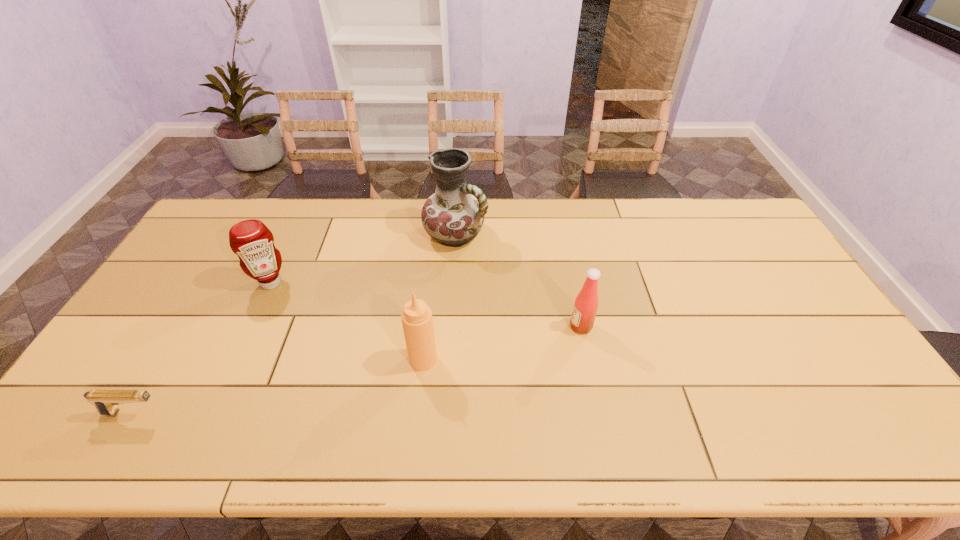
This screenshot has height=540, width=960. I want to click on vacant space that is in between the leftmost condiment and the nearest condiment, so click(348, 321).

Find the location of `vacant space that's between the fourth farthest object and the leftmost condiment`. vacant space that's between the fourth farthest object and the leftmost condiment is located at coordinates (348, 321).

Image resolution: width=960 pixels, height=540 pixels. Find the location of `empty location between the shortest object and the nearest condiment`. empty location between the shortest object and the nearest condiment is located at coordinates (278, 386).

Where is `free spot between the second farthest condiment and the fourth farthest object`? The image size is (960, 540). free spot between the second farthest condiment and the fourth farthest object is located at coordinates (502, 343).

Where is `the closest object relative to the second nearest object`? the closest object relative to the second nearest object is located at coordinates (585, 306).

This screenshot has height=540, width=960. What are the coordinates of `object that is the closest to the leftmost object` in the screenshot? It's located at (251, 240).

Choose which condiment is the nearest neighbor to the farthest condiment. Please provide its 2D coordinates. Your answer should be formatted as a tuple, i.e. [(x, y)], where the tuple contains the x and y coordinates of a point satisfying the conditions above.

[(417, 321)]

Identify which condiment is the second nearest to the fourth nearest object. Please provide its 2D coordinates. Your answer should be formatted as a tuple, i.e. [(x, y)], where the tuple contains the x and y coordinates of a point satisfying the conditions above.

[(585, 306)]

Identify the location of vacant region that satisfies the following two spatial constraints: 1. on the back side of the second nearest object; 2. on the left side of the farthest object. 437,235.